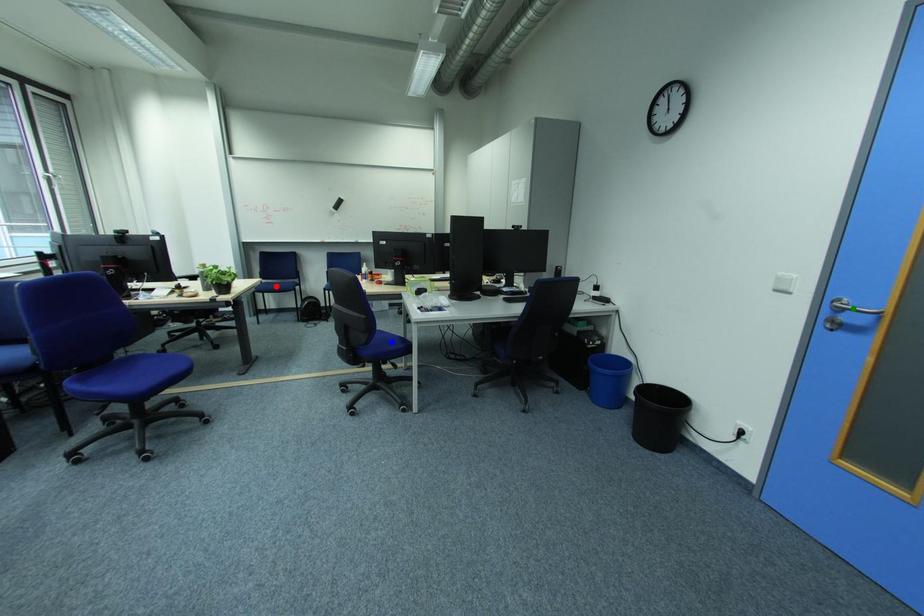
Order these from nearest to farthest:
green point | red point | blue point

green point < blue point < red point